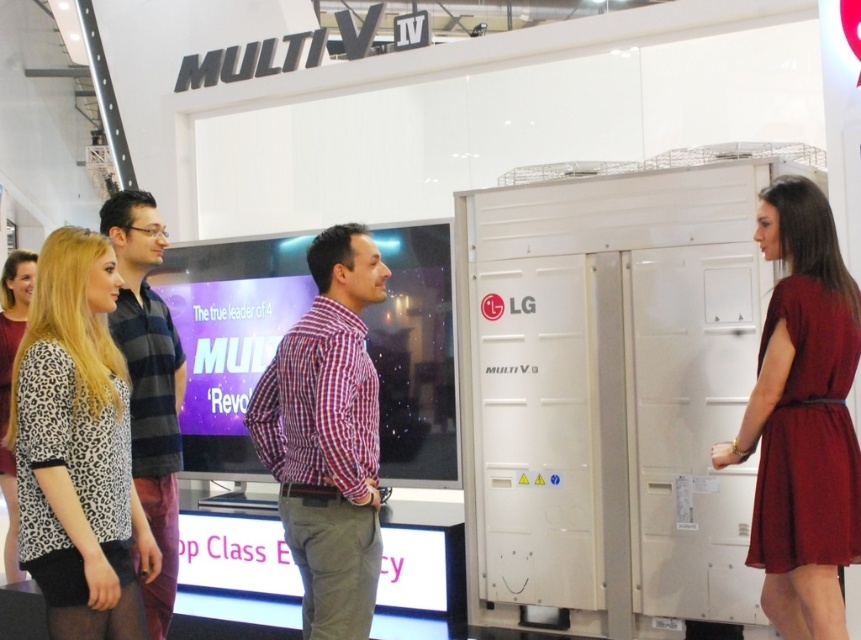
What is the exact coordinate of the leopard print blouse at center in the image?

The leopard print blouse at center is located at coordinate point (77, 449).

Looking at this image, you are attending a trade show and notice two people wearing the burgundy satin dress at right and the red checkered shirt at center. Which one is closer to you?

The burgundy satin dress at right is closer to you because the red checkered shirt at center is behind it.